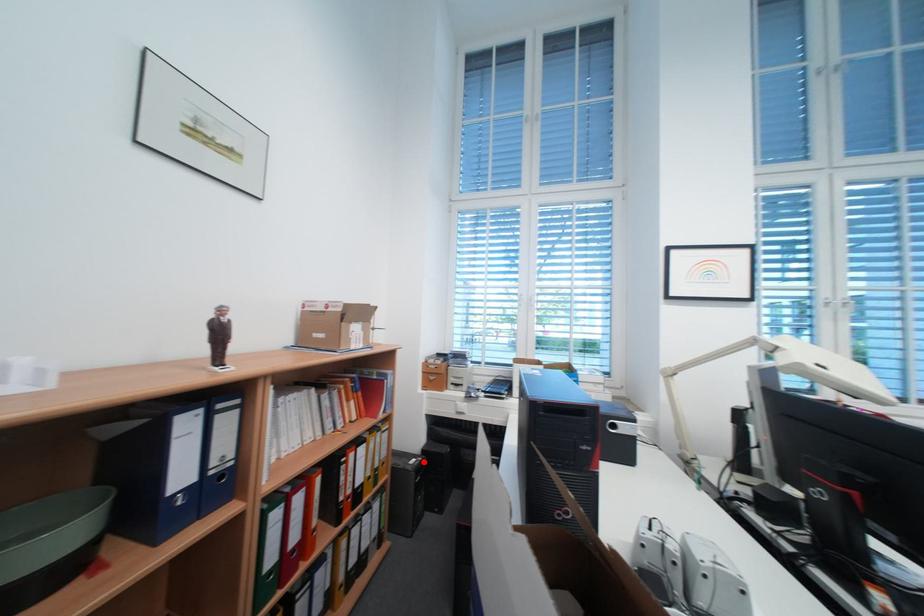
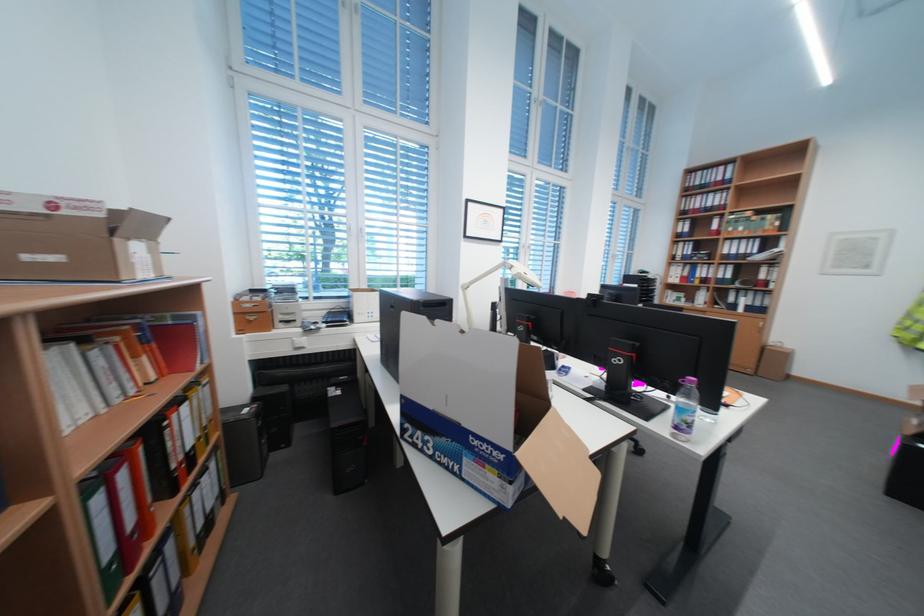
Question: I am providing you with two images of the same scene from different viewpoints. A red point is shown in image1. For the corresponding object point in image2, is it positioned nearer or farther from the camera?

Choices:
 (A) Nearer
 (B) Farther

Answer: (A)